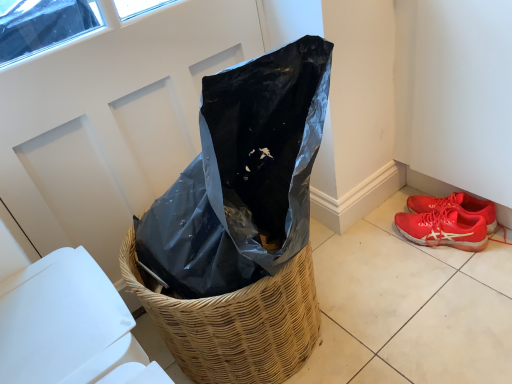
Find the location of `empty space that is in between shiny red sneakers at lower right and woven straw basket at center`. empty space that is in between shiny red sneakers at lower right and woven straw basket at center is located at coordinates (385, 275).